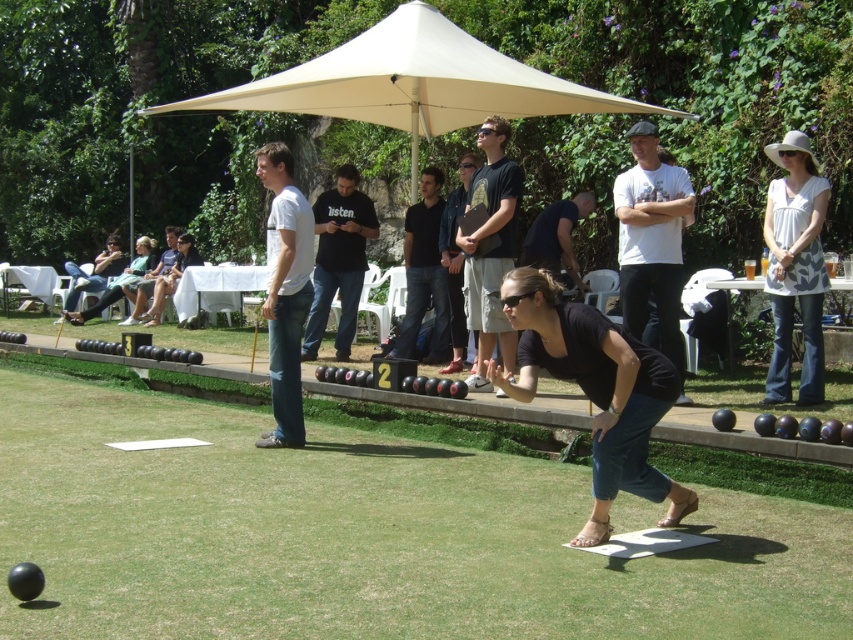
Question: Does black matte shirt at center appear on the right side of white cotton shirt at upper right?

Choices:
 (A) no
 (B) yes

Answer: (A)

Question: Does black matte shirt at center lie in front of white cotton shirt at upper right?

Choices:
 (A) yes
 (B) no

Answer: (A)

Question: Which of the following is the closest to the observer?

Choices:
 (A) black matte shirt at center
 (B) white cotton shirt at upper right

Answer: (A)

Question: Which object is farther from the camera taking this photo?

Choices:
 (A) black matte shirt at center
 (B) white cotton shirt at upper right

Answer: (B)

Question: Considering the relative positions of black matte shirt at center and white cotton shirt at upper right in the image provided, where is black matte shirt at center located with respect to white cotton shirt at upper right?

Choices:
 (A) below
 (B) above

Answer: (A)